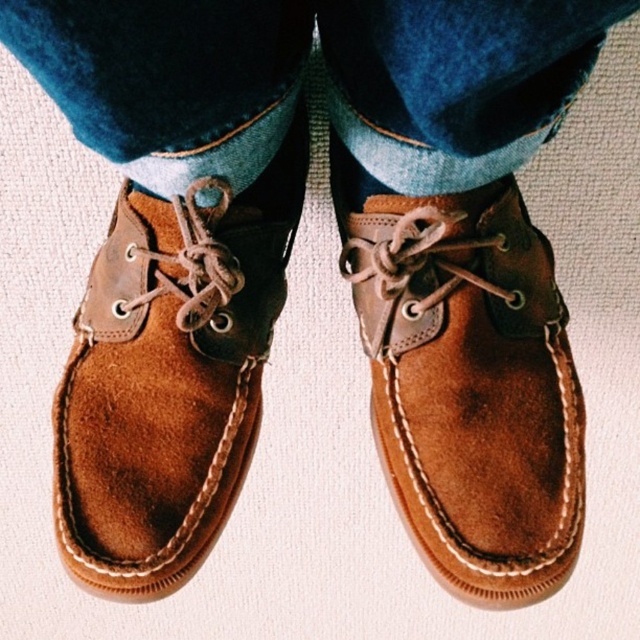
Is brown suede shoe at center below suede brown shoe at center?

Yes, brown suede shoe at center is below suede brown shoe at center.

Who is lower down, brown suede shoe at center or suede brown shoe at center?

brown suede shoe at center

Where is `brown suede shoe at center`? The image size is (640, 640). brown suede shoe at center is located at coordinates click(x=467, y=380).

Can you confirm if denim at center is taller than suede brown shoe at center?

No.

Can you confirm if denim at center is smaller than suede brown shoe at center?

Actually, denim at center might be larger than suede brown shoe at center.

Does point (250, 164) come closer to viewer compared to point (179, 412)?

Yes.

Locate an element on the screen. Image resolution: width=640 pixels, height=640 pixels. denim at center is located at coordinates (300, 80).

Does denim at center appear on the right side of brown suede shoe at center?

In fact, denim at center is to the left of brown suede shoe at center.

Can you confirm if denim at center is smaller than brown suede shoe at center?

No.

Who is more forward, (136, 12) or (534, 250)?

Point (136, 12)

At what (x,y) coordinates should I click in order to perform the action: click on denim at center. Please return your answer as a coordinate pair (x, y). The image size is (640, 640). Looking at the image, I should click on (300, 80).